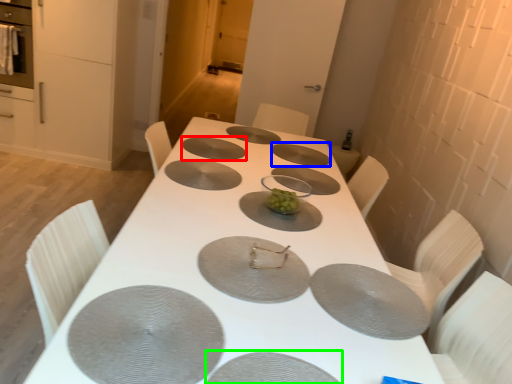
Question: Estimate the real-world distances between objects in this image. Which object is closer to pizza pan (highlighted by a red box), pizza pan (highlighted by a blue box) or pizza pan (highlighted by a green box)?

Choices:
 (A) pizza pan
 (B) pizza pan

Answer: (A)